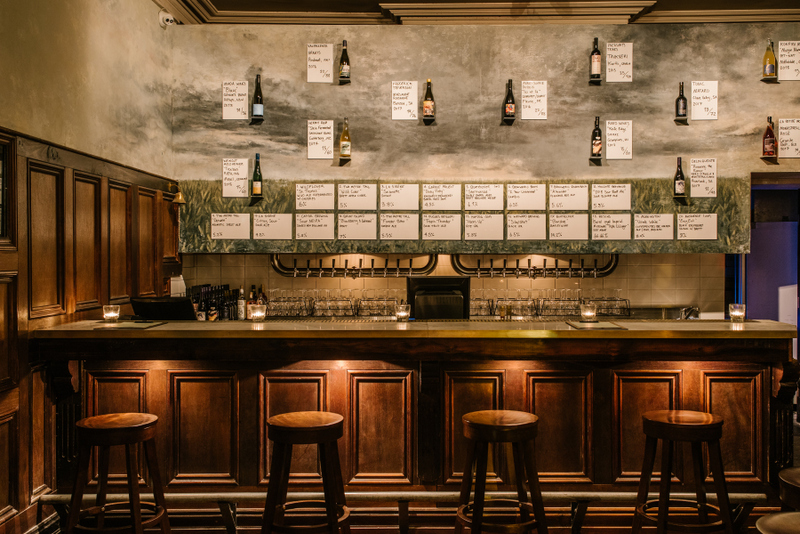
Locate an element on the screen. The width and height of the screenshot is (800, 534). candles is located at coordinates (112, 309), (254, 314), (406, 311), (582, 311), (737, 309).